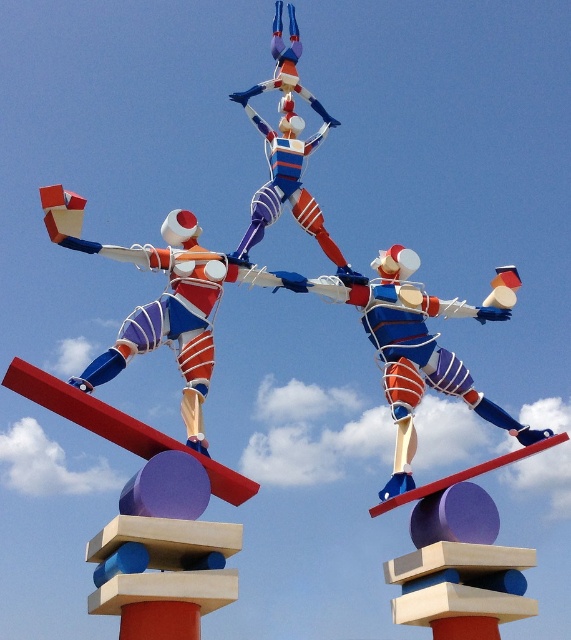
Question: Which point is farther to the camera?

Choices:
 (A) metallic blue and white figure at center
 (B) shiny metallic figure at center

Answer: (B)

Question: From the image, what is the correct spatial relationship of matte plastic figure at center in relation to shiny metallic figure at center?

Choices:
 (A) right
 (B) left

Answer: (B)

Question: Is metallic blue and white figure at center to the right of shiny metallic figure at center from the viewer's perspective?

Choices:
 (A) no
 (B) yes

Answer: (B)

Question: Which point is farther to the camera?

Choices:
 (A) (111, 364)
 (B) (254, 109)
 (C) (412, 294)

Answer: (B)

Question: Considering the real-world distances, which object is closest to the metallic blue and white figure at center?

Choices:
 (A) shiny metallic figure at center
 (B) matte plastic figure at center

Answer: (A)

Question: Is metallic blue and white figure at center further to camera compared to matte plastic figure at center?

Choices:
 (A) no
 (B) yes

Answer: (B)